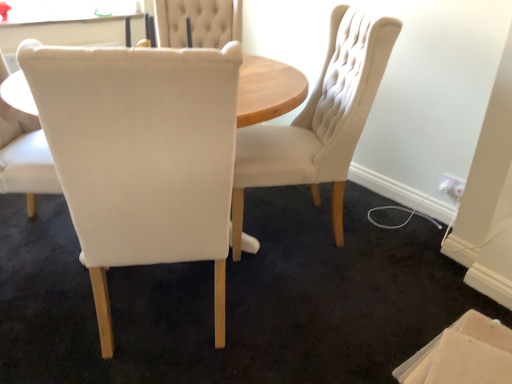
Question: Would you say matte white chair at center, the second chair when ordered from right to left, is inside or outside white fabric chair at center, which appears as the 3th chair when viewed from the right?

Choices:
 (A) outside
 (B) inside

Answer: (A)

Question: Visually, is matte white chair at center, acting as the second chair starting from the left, positioned to the left or to the right of white fabric chair at center, the first chair when ordered from left to right?

Choices:
 (A) left
 (B) right

Answer: (B)

Question: Which object is the farthest from the matte cream chair at center, arranged as the first chair when viewed from the right?

Choices:
 (A) beige cardboard box at lower right
 (B) matte white chair at center, the second chair when ordered from right to left
 (C) white fabric chair at center, the first chair when ordered from left to right

Answer: (C)

Question: Estimate the real-world distances between objects in this image. Which object is closer to the matte white chair at center, acting as the second chair starting from the left?

Choices:
 (A) matte cream chair at center, which appears as the third chair when viewed from the left
 (B) beige cardboard box at lower right
 (C) white fabric chair at center, which appears as the 3th chair when viewed from the right

Answer: (C)